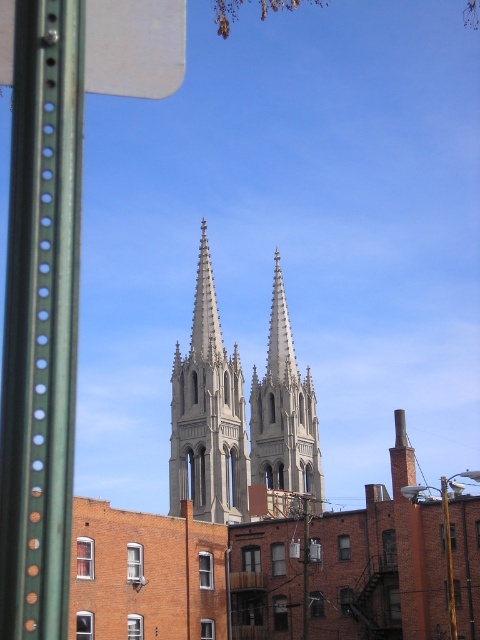
Does gray stone spire at center come in front of smooth gray stone spire at center?

No, gray stone spire at center is further to the viewer.

Is gray stone spire at center to the right of smooth gray stone spire at center from the viewer's perspective?

In fact, gray stone spire at center is to the left of smooth gray stone spire at center.

Does point (188, 474) come in front of point (259, 472)?

Yes, point (188, 474) is closer to viewer.

Locate an element on the screen. gray stone spire at center is located at coordinates (207, 413).